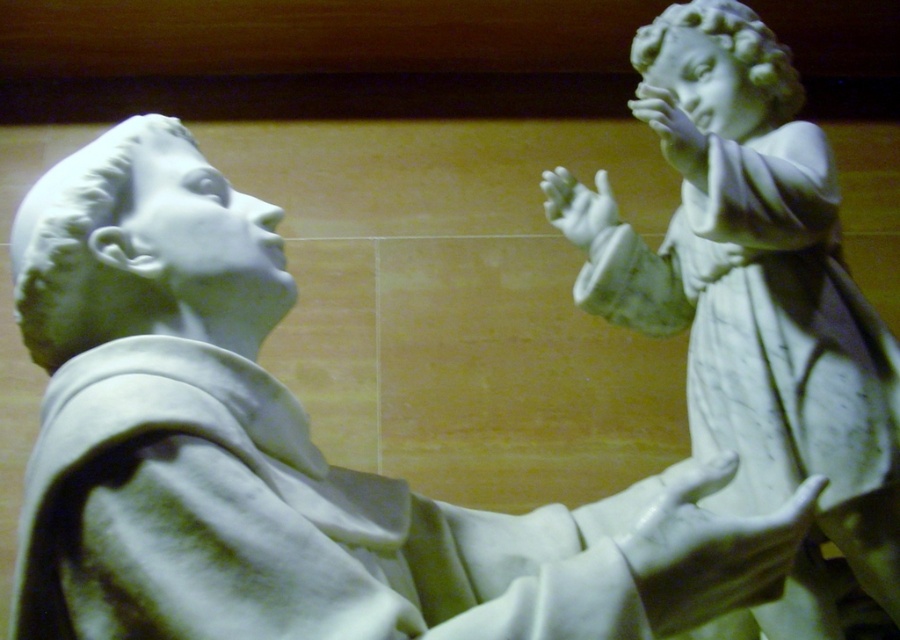
You are an art conservator examining the two white marble hands in the image. Which hand has a greater height measurement between the white marble hand at lower right and the white marble hand at center?

The white marble hand at lower right is taller than the white marble hand at center, so it has a greater height measurement.

You are an art conservator working on the statues in the image. You need to place a protective cloth over the white marble statue at right. Based on its coordinates, where should you position the cloth?

The white marble statue at right is located at coordinates point (762, 292), so you should position the cloth there.